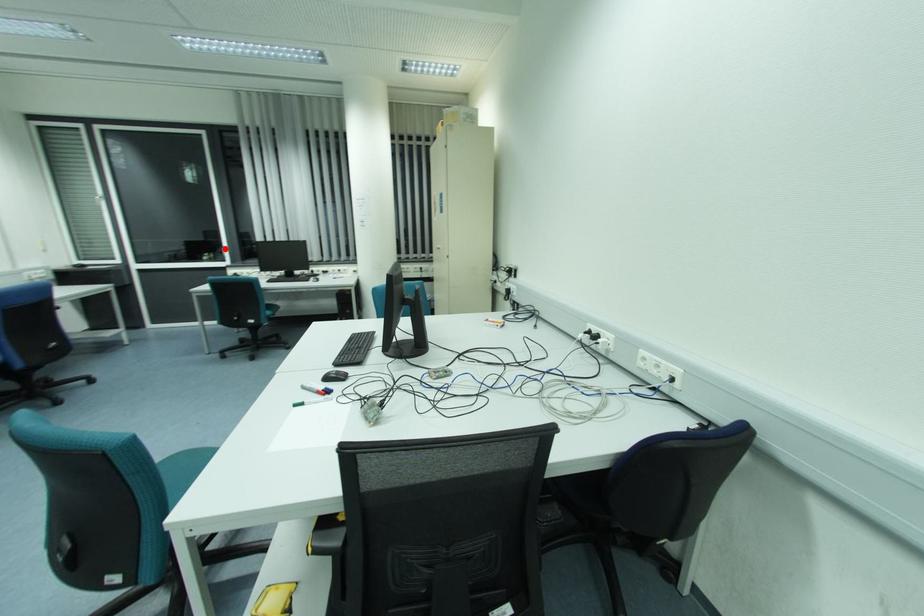
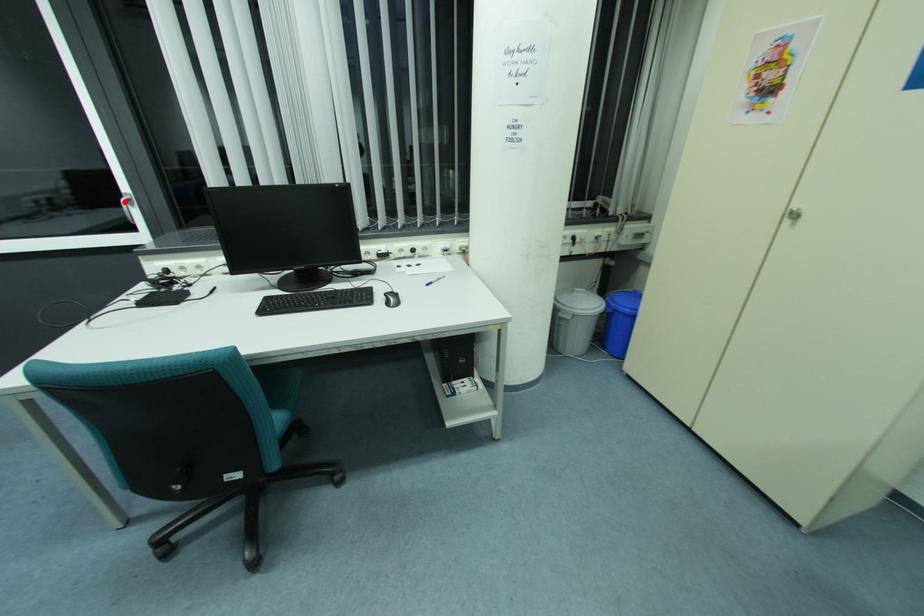
I am providing you with two images of the same scene from different viewpoints. A red point is marked on the first image and another point is marked on the second image. Does the point marked in image1 correspond to the same location as the one in image2?

Yes